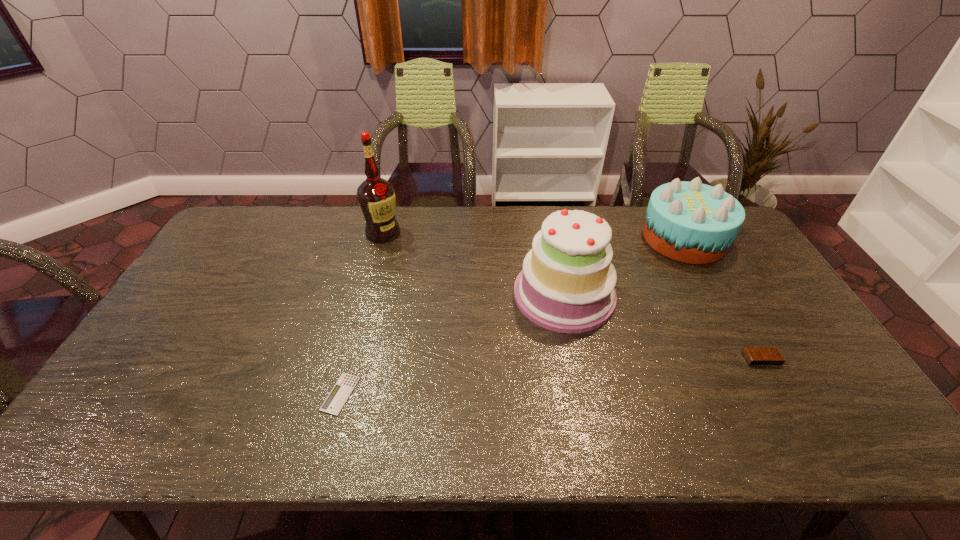
The image size is (960, 540). Identify the location of vacant space located on the left of the fourth shortest object. click(411, 294).

Find the location of a particular element. vacant space situated on the left of the third tallest object is located at coordinates (608, 238).

Image resolution: width=960 pixels, height=540 pixels. Identify the location of vacant space located on the front face of the alarm clock. (798, 423).

Where is `vacant space located 0.160m on the right of the calculator`? Image resolution: width=960 pixels, height=540 pixels. vacant space located 0.160m on the right of the calculator is located at coordinates (422, 394).

Where is `alcohol that is at the far edge`? The height and width of the screenshot is (540, 960). alcohol that is at the far edge is located at coordinates (376, 196).

The height and width of the screenshot is (540, 960). I want to click on cake located in the far edge section of the desktop, so click(690, 222).

Identify the location of object present at the near edge. (336, 399).

You are a GUI agent. You are given a task and a screenshot of the screen. Output one action in this format:
    pyautogui.click(x=<x>, y=<y>)
    Task: Click on the cake located in the right edge section of the desktop
    Image resolution: width=960 pixels, height=540 pixels.
    Given the screenshot: What is the action you would take?
    pyautogui.click(x=690, y=222)

The width and height of the screenshot is (960, 540). I want to click on alarm clock located in the right edge section of the desktop, so click(x=755, y=356).

Locate an element on the screen. The height and width of the screenshot is (540, 960). object at the far right corner is located at coordinates (690, 222).